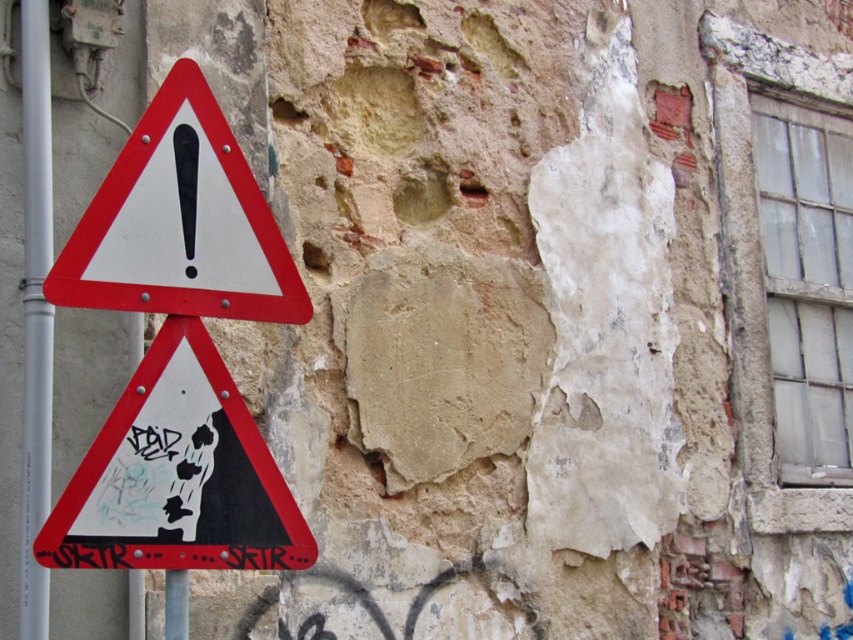
You are a construction worker who needs to place a 4.5 feet long ladder against the wall. The ladder must be placed between the red plastic triangle at left and the metallic pole at left. Is there enough space between them for the ladder?

The red plastic triangle at left is 3.44 feet from the metallic pole at left. Since the ladder is 4.5 feet long, which is longer than the distance between them, there isn t enough space to place the ladder between the red plastic triangle at left and the metallic pole at left.

You are a pedestrian walking past the wall with two triangular warning signs. You notice the matte red triangle at left and the red plastic triangle at left. Which one is positioned lower on the pole?

The matte red triangle at left is positioned lower on the pole because it is below the red plastic triangle at left.

You are standing in front of the wall with the two triangular warning signs. There is a point at coordinates [180,221]. Which object is this point located on?

The point at coordinates [180,221] is located on the red plastic triangle at left.